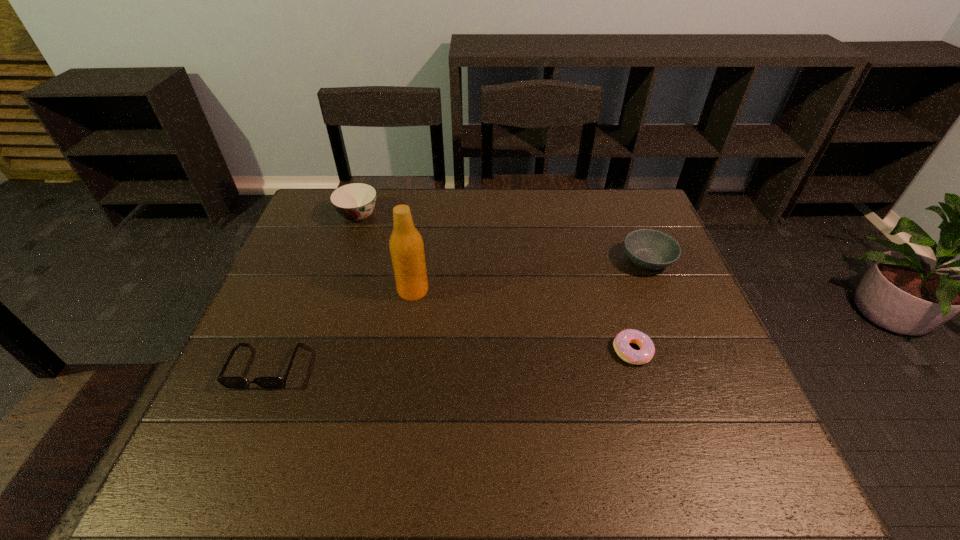
In the image, there is a desktop. Where is `free space at the near edge`? The image size is (960, 540). free space at the near edge is located at coordinates (577, 462).

Find the location of a particular element. Image resolution: width=960 pixels, height=540 pixels. free space at the left edge of the desktop is located at coordinates (313, 291).

This screenshot has width=960, height=540. What are the coordinates of `free space at the right edge of the desktop` in the screenshot? It's located at (703, 376).

Where is `free space at the far right corner of the desktop`? free space at the far right corner of the desktop is located at coordinates (639, 188).

At what (x,y) coordinates should I click in order to perform the action: click on free space between the third tallest object and the third nearest object. Please return your answer as a coordinate pair (x, y). The height and width of the screenshot is (540, 960). Looking at the image, I should click on (530, 275).

I want to click on empty space between the third nearest object and the doughnut, so click(522, 321).

Locate an element on the screen. free space between the shorter soup bowl and the left soup bowl is located at coordinates (503, 238).

You are a GUI agent. You are given a task and a screenshot of the screen. Output one action in this format:
    pyautogui.click(x=<x>, y=<y>)
    Task: Click on the free point between the shorter soup bowl and the farthest object
    Image resolution: width=960 pixels, height=540 pixels.
    Given the screenshot: What is the action you would take?
    pyautogui.click(x=503, y=238)

At what (x,y) coordinates should I click in order to perform the action: click on blank region between the fourth tallest object and the third object from right to left. Please return your answer as a coordinate pair (x, y). This screenshot has width=960, height=540. Looking at the image, I should click on (340, 328).

This screenshot has width=960, height=540. Find the location of `free space between the right soup bowl and the shortest object`. free space between the right soup bowl and the shortest object is located at coordinates (640, 306).